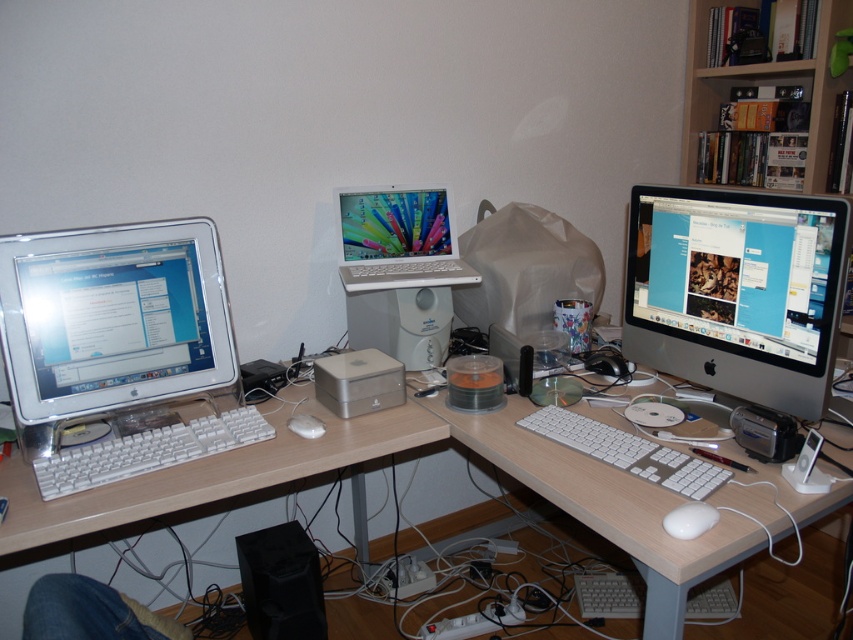
Question: Which is farther from the light brown wood desk at lower left?

Choices:
 (A) white plastic keyboard at left
 (B) white matte mouse at center
 (C) black plastic speaker at lower center
 (D) white plastic keyboard at lower right

Answer: (C)

Question: Does white plastic laptop at center have a larger size compared to white matte keyboard at center?

Choices:
 (A) no
 (B) yes

Answer: (B)

Question: Does white plastic keyboard at left have a larger size compared to black plastic speaker at lower center?

Choices:
 (A) no
 (B) yes

Answer: (A)

Question: Which object is positioned farthest from the white plastic keyboard at lower right?

Choices:
 (A) white matte mouse at center
 (B) white plastic laptop at center
 (C) wooden bookshelf at upper right

Answer: (C)

Question: Which object is farther from the camera taking this photo?

Choices:
 (A) white plastic laptop at center
 (B) white matte keyboard at center
 (C) light brown wood desk at lower left
 (D) wooden bookshelf at upper right

Answer: (D)

Question: Is wooden bookshelf at upper right above white matte mouse at center?

Choices:
 (A) no
 (B) yes

Answer: (B)